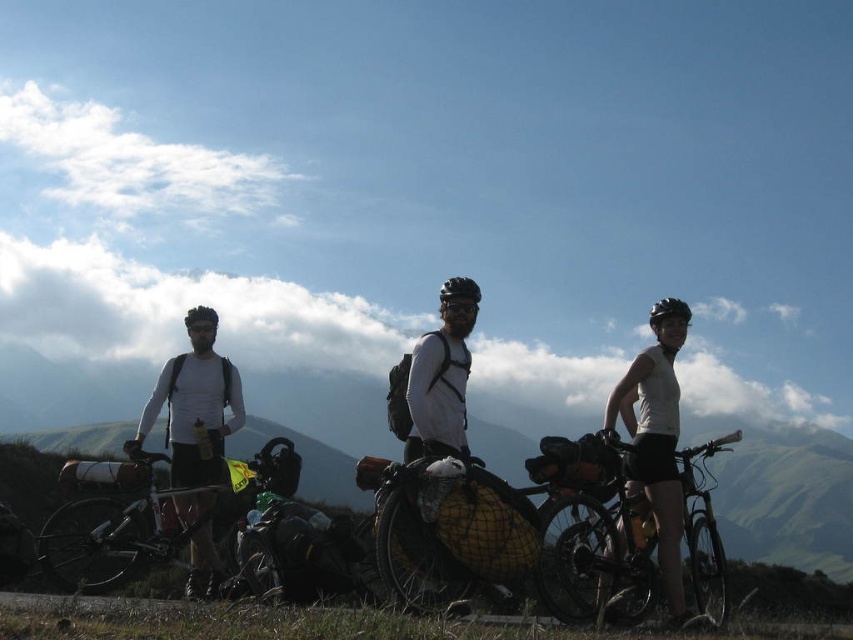
Question: Does white matte bicycle at center appear on the left side of white matte helmet at center?

Choices:
 (A) no
 (B) yes

Answer: (A)

Question: Which object is the farthest from the matte black bicycle at center?

Choices:
 (A) white matte shirt at left
 (B) silver metallic bicycle at center

Answer: (A)

Question: Which object is the closest to the matte black bicycle at center?

Choices:
 (A) white matte shirt at left
 (B) white matte helmet at center

Answer: (B)

Question: From the image, what is the correct spatial relationship of matte black bicycle at center in relation to white matte helmet at center?

Choices:
 (A) right
 (B) left

Answer: (A)

Question: Is white matte helmet at center thinner than black matte bicycle helmet at center?

Choices:
 (A) no
 (B) yes

Answer: (A)

Question: Which object appears closest to the camera in this image?

Choices:
 (A) white matte shirt at left
 (B) matte black bicycle at center
 (C) black matte bicycle helmet at center
 (D) white matte bicycle at center

Answer: (B)